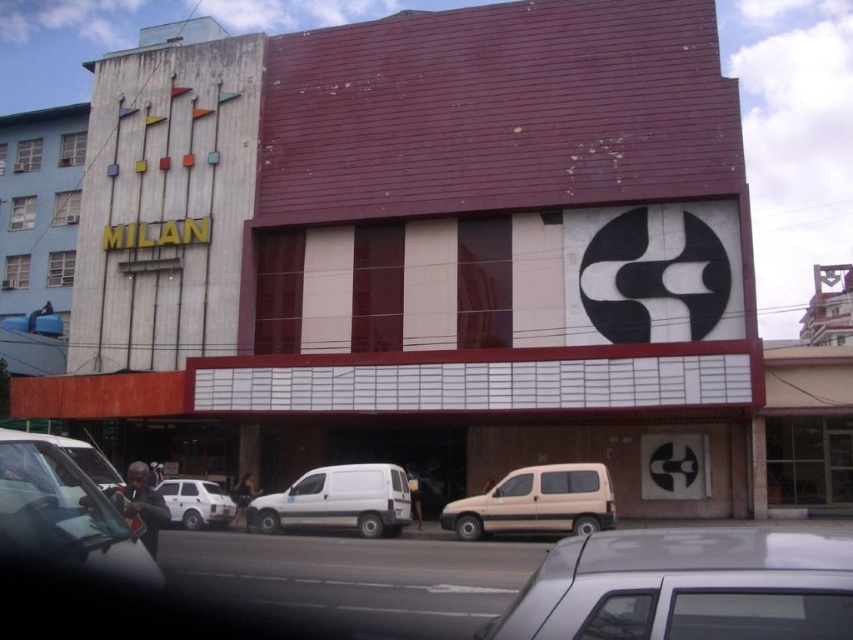
Question: Among these objects, which one is farthest from the camera?

Choices:
 (A) white matte car at lower left
 (B) metallic silver car at center

Answer: (A)

Question: Considering the relative positions of metallic silver car at center and white matte van at center in the image provided, where is metallic silver car at center located with respect to white matte van at center?

Choices:
 (A) below
 (B) above

Answer: (B)

Question: Which object is closer to the camera taking this photo?

Choices:
 (A) beige matte van at center
 (B) metallic silver car at lower left
 (C) maroon brick theater at center
 (D) white matte car at lower left

Answer: (B)

Question: Can you confirm if maroon brick theater at center is smaller than beige matte van at center?

Choices:
 (A) yes
 (B) no

Answer: (B)

Question: Which object appears farthest from the camera in this image?

Choices:
 (A) white matte van at center
 (B) maroon brick theater at center
 (C) beige matte van at center
 (D) metallic silver car at center

Answer: (B)

Question: Does metallic silver car at lower left have a larger size compared to white matte van at center?

Choices:
 (A) yes
 (B) no

Answer: (A)